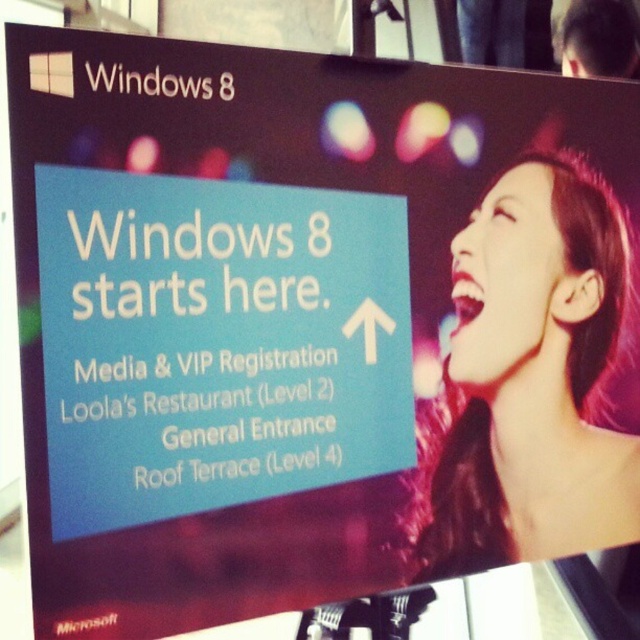
Between blue paper sign at center and shiny hair at upper right, which one is positioned lower?

shiny hair at upper right

Does blue paper sign at center have a lesser height compared to shiny hair at upper right?

Yes, blue paper sign at center is shorter than shiny hair at upper right.

Does point (141, 310) come closer to viewer compared to point (595, 330)?

Yes, it is in front of point (595, 330).

This screenshot has width=640, height=640. Identify the location of blue paper sign at center. (216, 342).